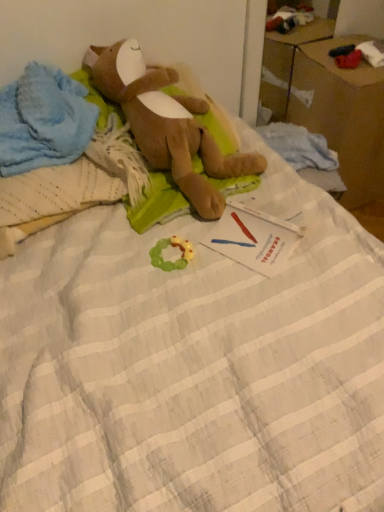
Question: Does point (342, 155) appear closer or farther from the camera than point (182, 267)?

Choices:
 (A) farther
 (B) closer

Answer: (A)

Question: Do you think brown cardboard box at upper right is within green rubber teething ring at center, the 2th toy when ordered from top to bottom, or outside of it?

Choices:
 (A) outside
 (B) inside

Answer: (A)

Question: Which of these objects is positioned farthest from the brown cardboard box at upper right?

Choices:
 (A) brown plush toy at upper left, the second toy positioned from the bottom
 (B) white paper at center
 (C) blue soft fabric at upper left
 (D) green rubber teething ring at center, the 2th toy positioned from the front

Answer: (C)

Question: Considering the real-world distances, which object is farthest from the blue soft fabric at upper left?

Choices:
 (A) green rubber teething ring at center, which appears as the 1th toy when viewed from the back
 (B) brown cardboard box at upper right
 (C) brown plush toy at upper left, the first toy viewed from the front
 (D) white paper at center

Answer: (B)